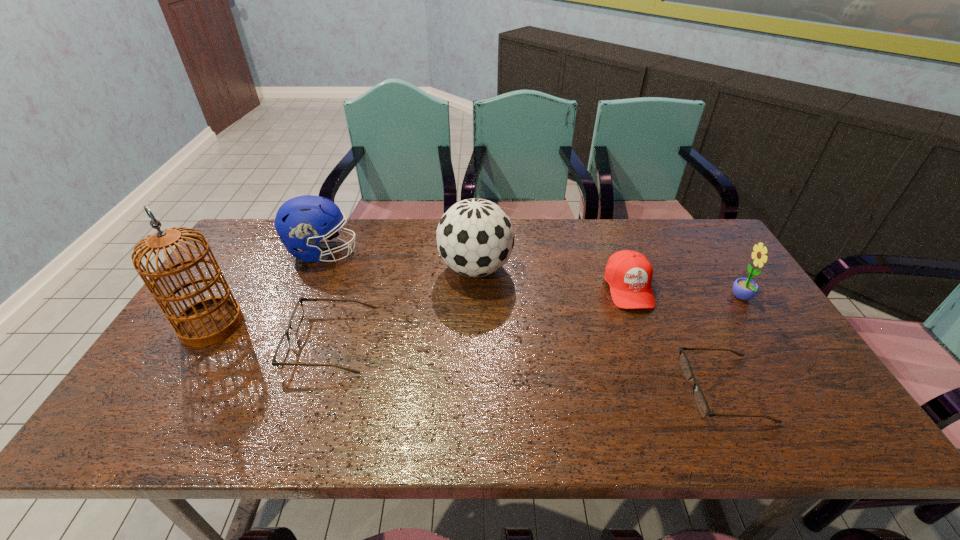
To make them evenly spaced by inserting another spectacles among them, please locate a vacant spot for this new spectacles. Please provide its 2D coordinates. Your answer should be formatted as a tuple, i.e. [(x, y)], where the tuple contains the x and y coordinates of a point satisfying the conditions above.

[(517, 363)]